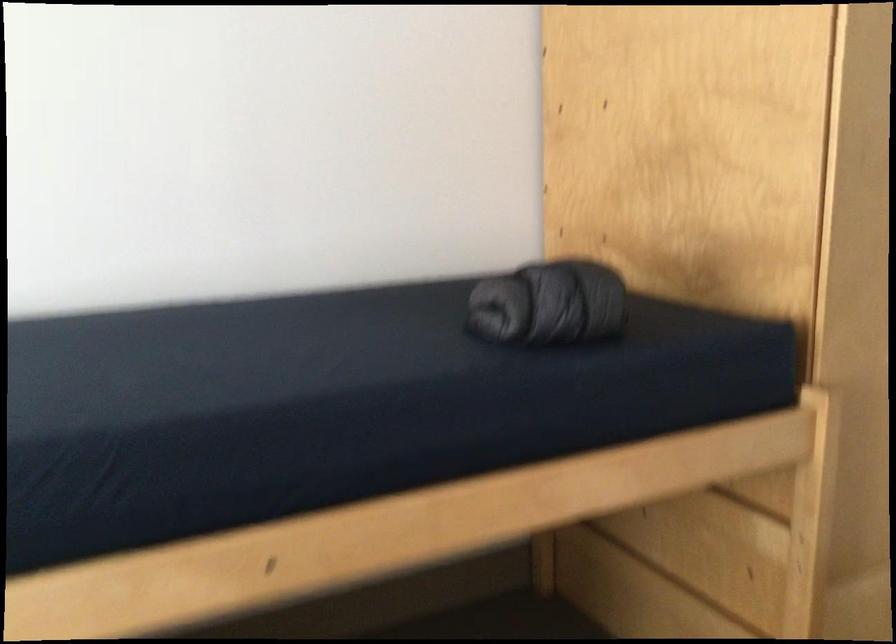
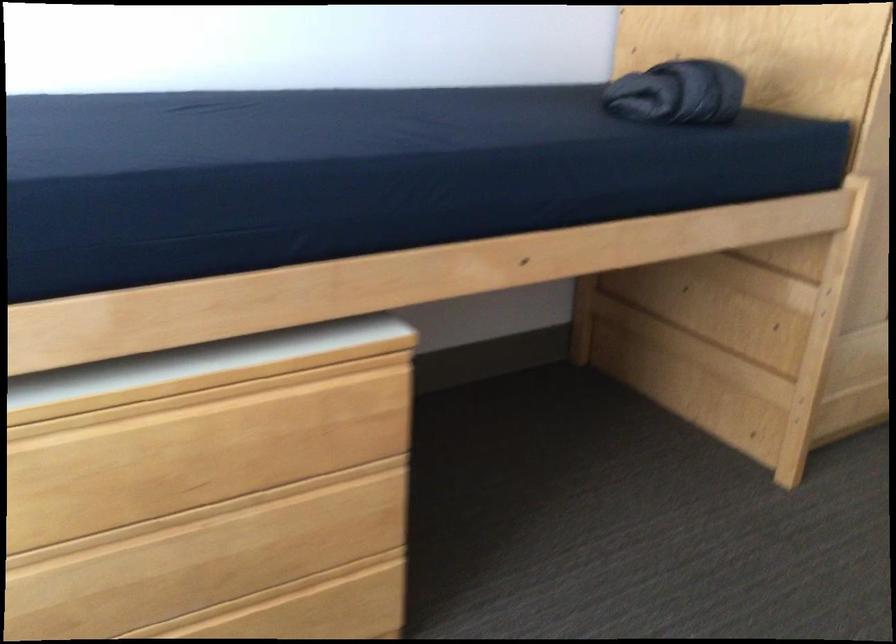
The images are taken continuously from a first-person perspective. In which direction are you moving?

The cameraman walked toward left, backward.